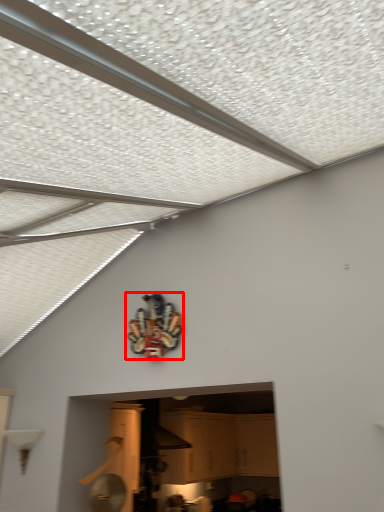
Question: Where is design (annotated by the red box) located in relation to cabinetry in the image?

Choices:
 (A) left
 (B) right

Answer: (A)